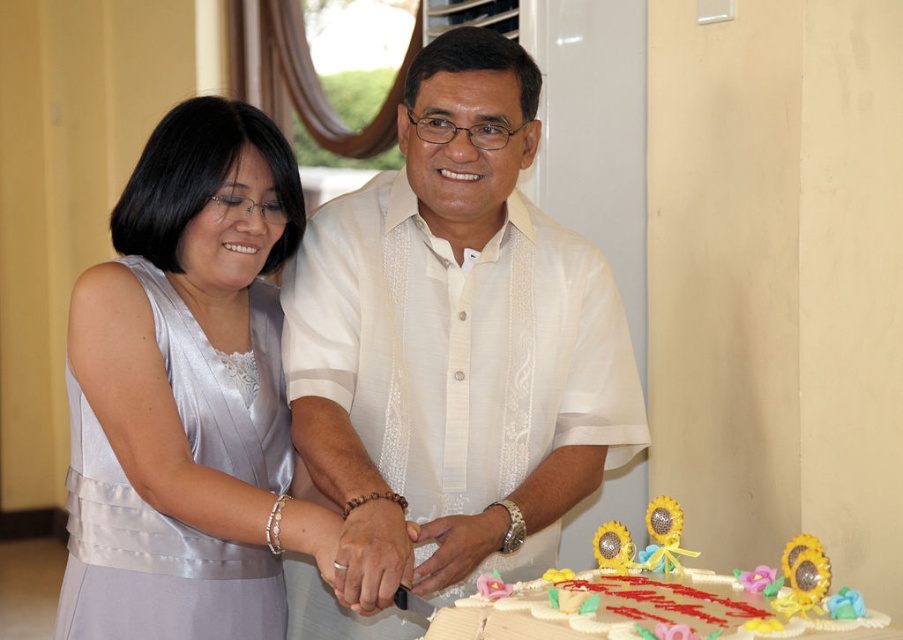
Question: Does satin dress at left have a greater width compared to white fondant cake at lower center?

Choices:
 (A) no
 (B) yes

Answer: (A)

Question: Is white sheer shirt at center further to the viewer compared to white fondant cake at lower center?

Choices:
 (A) yes
 (B) no

Answer: (A)

Question: Which object appears farthest from the camera in this image?

Choices:
 (A) white sheer shirt at center
 (B) satin dress at left
 (C) white fondant cake at lower center

Answer: (B)

Question: Does satin dress at left appear on the left side of white fondant cake at lower center?

Choices:
 (A) yes
 (B) no

Answer: (A)

Question: Among these points, which one is nearest to the camera?

Choices:
 (A) (369, 259)
 (B) (592, 621)
 (C) (202, 134)

Answer: (B)

Question: Which object is farther from the camera taking this photo?

Choices:
 (A) white sheer shirt at center
 (B) white fondant cake at lower center

Answer: (A)